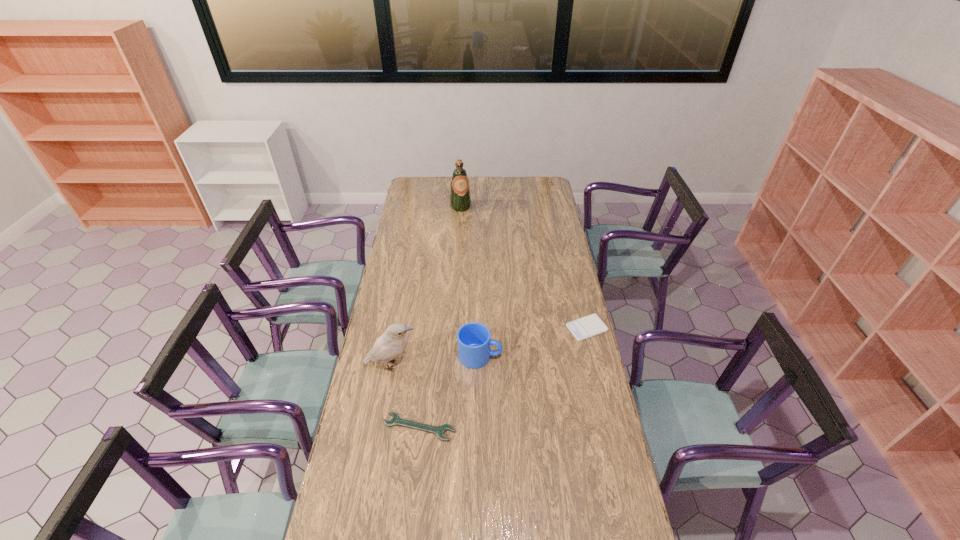
Locate an element on the screen. free location located 0.060m at the beak of the second tallest object is located at coordinates (434, 364).

The height and width of the screenshot is (540, 960). I want to click on vacant region located at the beak of the second tallest object, so click(486, 363).

In order to click on blank space located 0.150m on the front-facing side of the farthest object in this screenshot , I will do `click(468, 227)`.

You are a GUI agent. You are given a task and a screenshot of the screen. Output one action in this format:
    pyautogui.click(x=<x>, y=<y>)
    Task: Click on the vacant region located on the front-facing side of the farthest object
    
    Given the screenshot: What is the action you would take?
    pyautogui.click(x=465, y=217)

Find the location of a particular element. free location located on the front-facing side of the farthest object is located at coordinates (473, 238).

Image resolution: width=960 pixels, height=540 pixels. Find the location of `blank area located on the side of the mug with the handle`. blank area located on the side of the mug with the handle is located at coordinates (526, 360).

Find the location of a particular element. free space located on the side of the mug with the handle is located at coordinates (546, 362).

Locate an element on the screen. The width and height of the screenshot is (960, 540). vacant space located on the side of the mug with the handle is located at coordinates (529, 361).

I want to click on wrench that is at the left edge, so click(x=439, y=431).

Identify the location of bird that is at the left edge. (388, 346).